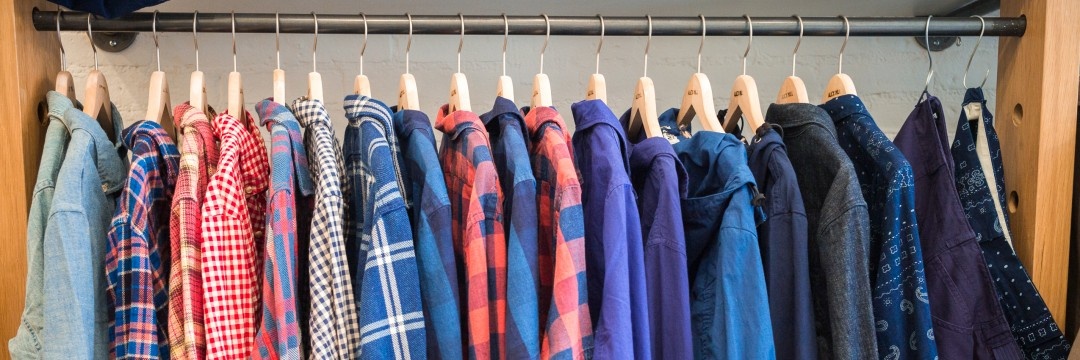
Locate an element on the screen. white wall is located at coordinates pyautogui.click(x=882, y=74).